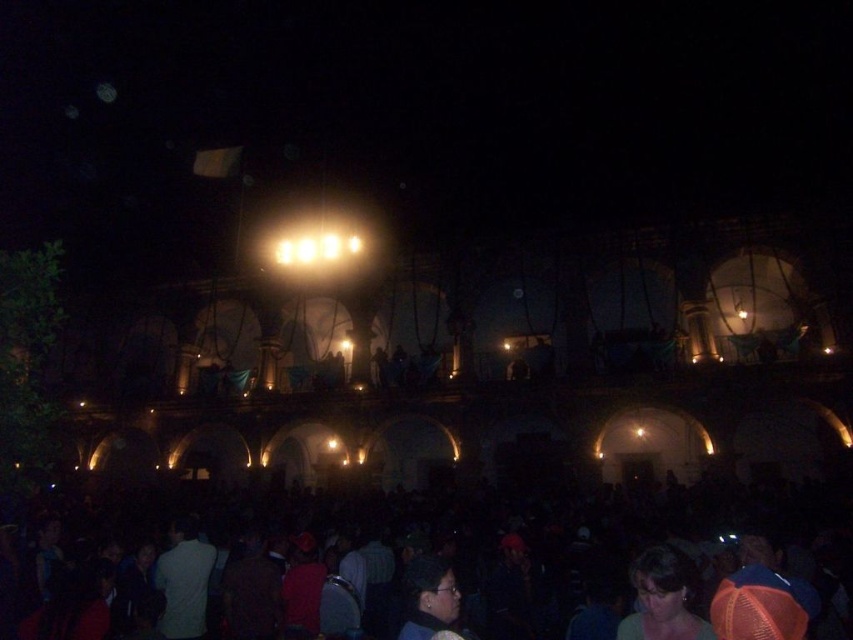
You are a photographer at the event and want to capture a photo of both the smooth brown hair at lower right and the matte black hair at lower center in the same frame. Which person has wider hair to ensure proper framing?

The smooth brown hair at lower right is wider than the matte black hair at lower center, so you should frame the shot to accommodate the width of the smooth brown hair at lower right.

You are standing in the crowd at the event and want to get a better view of the historic building. You notice the dark matte crowd at lower center and the smooth brown hair at lower right. Which of these two would block your view more if you are trying to look towards the building?

The dark matte crowd at lower center is closer to the viewer than the smooth brown hair at lower right, so it would block your view more when trying to look towards the historic building.

You are a photographer at the event and want to take a photo of both the smooth brown hair at lower right and the matte black hair at lower center. Which person should you adjust your camera focus to first to ensure they are in frame?

The smooth brown hair at lower right is not as tall as matte black hair at lower center, so you should focus on the matte black hair at lower center first to ensure both are in frame.